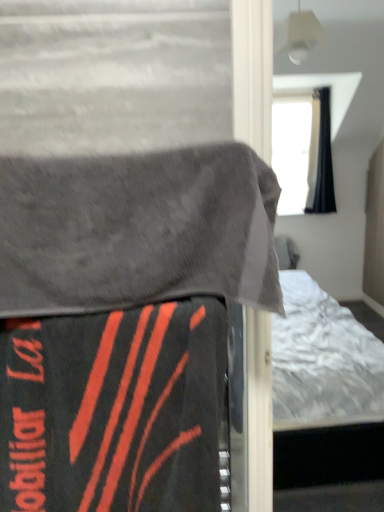
Where is `free point above velvet-like black bed at center (from a real-world perspective)`? This screenshot has height=512, width=384. free point above velvet-like black bed at center (from a real-world perspective) is located at coordinates (106, 148).